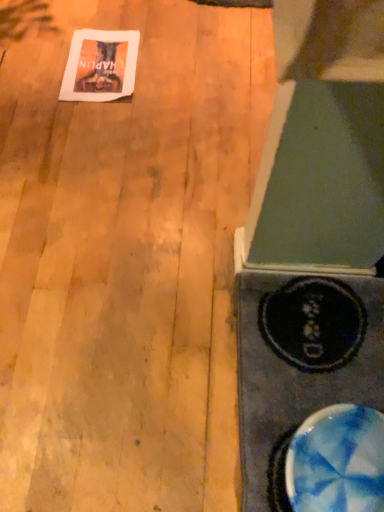
Question: Is white paper at upper left smaller than wooden floor at upper left?

Choices:
 (A) no
 (B) yes

Answer: (B)

Question: Considering the relative positions of white paper at upper left and wooden floor at upper left in the image provided, is white paper at upper left to the right of wooden floor at upper left from the viewer's perspective?

Choices:
 (A) yes
 (B) no

Answer: (B)

Question: Considering the relative positions of white paper at upper left and wooden floor at upper left in the image provided, is white paper at upper left in front of wooden floor at upper left?

Choices:
 (A) yes
 (B) no

Answer: (B)

Question: Is white paper at upper left shorter than wooden floor at upper left?

Choices:
 (A) no
 (B) yes

Answer: (B)

Question: Does white paper at upper left have a lesser width compared to wooden floor at upper left?

Choices:
 (A) no
 (B) yes

Answer: (B)

Question: Do you think white paper at upper left is within wooden floor at upper left, or outside of it?

Choices:
 (A) outside
 (B) inside

Answer: (B)

Question: In terms of width, does white paper at upper left look wider or thinner when compared to wooden floor at upper left?

Choices:
 (A) wide
 (B) thin

Answer: (B)

Question: From the image's perspective, relative to wooden floor at upper left, is white paper at upper left above or below?

Choices:
 (A) below
 (B) above

Answer: (B)

Question: In terms of height, does white paper at upper left look taller or shorter compared to wooden floor at upper left?

Choices:
 (A) short
 (B) tall

Answer: (A)

Question: Based on their sizes in the image, would you say blue marbled bowl at lower right is bigger or smaller than wooden floor at upper left?

Choices:
 (A) small
 (B) big

Answer: (A)

Question: In terms of width, does blue marbled bowl at lower right look wider or thinner when compared to wooden floor at upper left?

Choices:
 (A) wide
 (B) thin

Answer: (B)

Question: Considering the positions of point (x=347, y=468) and point (x=243, y=61), is point (x=347, y=468) closer or farther from the camera than point (x=243, y=61)?

Choices:
 (A) farther
 (B) closer

Answer: (B)

Question: Considering the relative positions of blue marbled bowl at lower right and wooden floor at upper left in the image provided, is blue marbled bowl at lower right to the left or to the right of wooden floor at upper left?

Choices:
 (A) right
 (B) left

Answer: (A)

Question: Does point (109, 59) appear closer or farther from the camera than point (380, 484)?

Choices:
 (A) closer
 (B) farther

Answer: (B)

Question: Considering the relative positions of white paper at upper left and blue marbled bowl at lower right in the image provided, is white paper at upper left to the left or to the right of blue marbled bowl at lower right?

Choices:
 (A) right
 (B) left

Answer: (B)